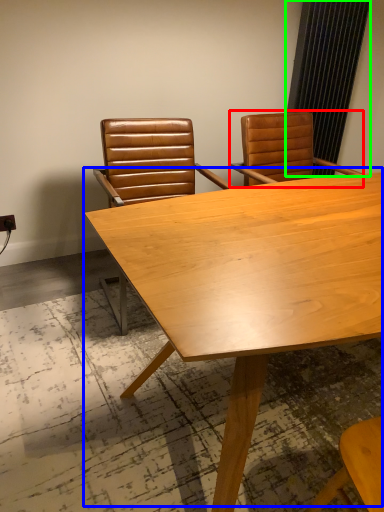
Question: Based on their relative distances, which object is farther from chair (highlighted by a red box)? Choose from table (highlighted by a blue box) and curtain (highlighted by a green box).

Choices:
 (A) table
 (B) curtain

Answer: (A)